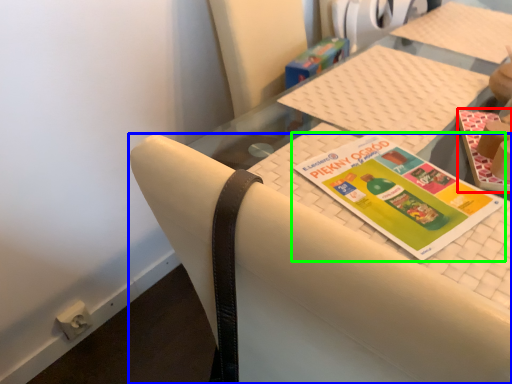
Question: Which is farther away from book (highlighted by a red box)? chair (highlighted by a blue box) or book (highlighted by a green box)?

Choices:
 (A) chair
 (B) book

Answer: (A)